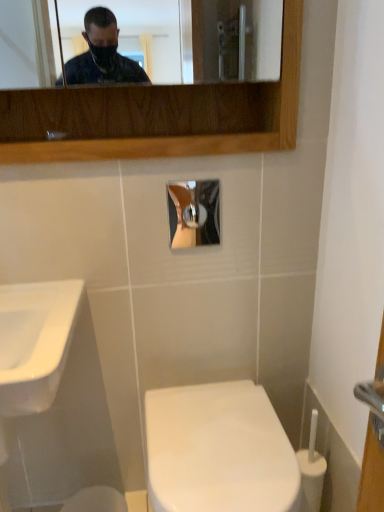
Question: Can you confirm if white glossy toilet at center is taller than matte silver faucet at upper center?

Choices:
 (A) yes
 (B) no

Answer: (A)

Question: Is the position of white glossy toilet at center more distant than that of matte silver faucet at upper center?

Choices:
 (A) no
 (B) yes

Answer: (A)

Question: From the image's perspective, would you say white glossy toilet at center is shown under matte silver faucet at upper center?

Choices:
 (A) yes
 (B) no

Answer: (A)

Question: Is white glossy toilet at center thinner than matte silver faucet at upper center?

Choices:
 (A) yes
 (B) no

Answer: (B)

Question: From a real-world perspective, is white glossy toilet at center located beneath matte silver faucet at upper center?

Choices:
 (A) no
 (B) yes

Answer: (B)

Question: Would you say white glossy toilet at center is to the left or to the right of white glossy toilet bowl at lower center in the picture?

Choices:
 (A) right
 (B) left

Answer: (A)

Question: From the image's perspective, is white glossy toilet at center above or below white glossy toilet bowl at lower center?

Choices:
 (A) below
 (B) above

Answer: (B)

Question: Is point (223, 392) positioned closer to the camera than point (69, 504)?

Choices:
 (A) farther
 (B) closer

Answer: (B)

Question: Considering the positions of white glossy toilet at center and white glossy toilet bowl at lower center in the image, is white glossy toilet at center bigger or smaller than white glossy toilet bowl at lower center?

Choices:
 (A) big
 (B) small

Answer: (A)

Question: Would you say white glossy toilet bowl at lower center is to the left or to the right of white glossy toilet at center in the picture?

Choices:
 (A) left
 (B) right

Answer: (A)

Question: Is white glossy toilet bowl at lower center wider or thinner than white glossy toilet at center?

Choices:
 (A) thin
 (B) wide

Answer: (A)

Question: Considering the positions of white glossy toilet bowl at lower center and white glossy toilet at center in the image, is white glossy toilet bowl at lower center bigger or smaller than white glossy toilet at center?

Choices:
 (A) big
 (B) small

Answer: (B)

Question: From a real-world perspective, is white glossy toilet bowl at lower center above or below white glossy toilet at center?

Choices:
 (A) below
 (B) above

Answer: (A)

Question: From a real-world perspective, relative to matte silver faucet at upper center, is white glossy sink at left vertically above or below?

Choices:
 (A) above
 (B) below

Answer: (B)

Question: In terms of width, does white glossy sink at left look wider or thinner when compared to matte silver faucet at upper center?

Choices:
 (A) thin
 (B) wide

Answer: (B)